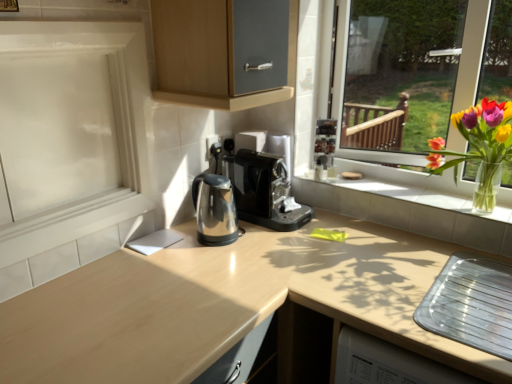
Locate an element on the screen. free location in front of black plastic coffee machine at center is located at coordinates (275, 253).